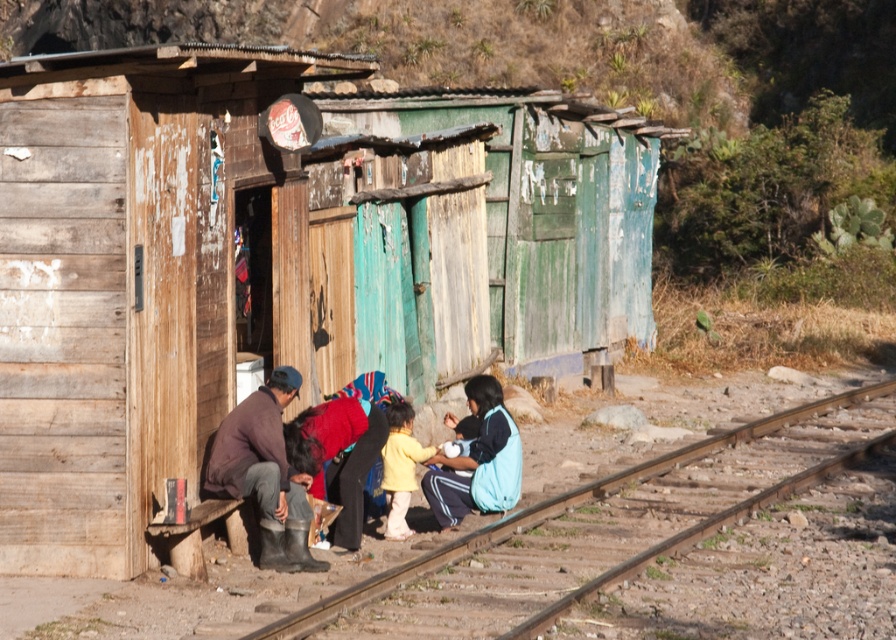
From the picture: You are standing in the rural area and want to approach the blue fleece jacket at lower right without passing in front of the weathered wood hut at center. Is this possible?

The weathered wood hut at center is positioned on the left side of blue fleece jacket at lower right, so you can approach the blue fleece jacket at lower right from the right side of the weathered wood hut at center without passing in front of it.

You are standing at the edge of the railway track and see the weathered wood hut at center and the brown wooden track at lower center. Which object is positioned to the left of the other?

The weathered wood hut at center is to the left of brown wooden track at lower center.

You are a railway worker who needs to inspect the brown wooden track at lower center. You are currently standing at the entrance of the weathered wood hut at center. Which direction should you move to reach the track?

The weathered wood hut at center is above the brown wooden track at lower center, so you should move downward from the weathered wood hut at center to reach the brown wooden track at lower center.